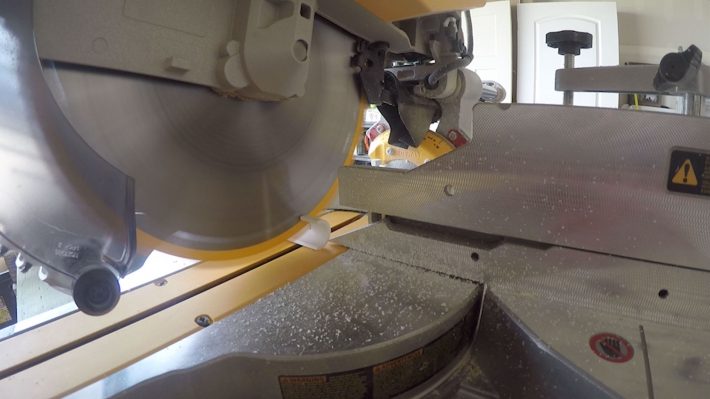
Locate an element on the screen. Image resolution: width=710 pixels, height=399 pixels. arch in door is located at coordinates (596, 26).